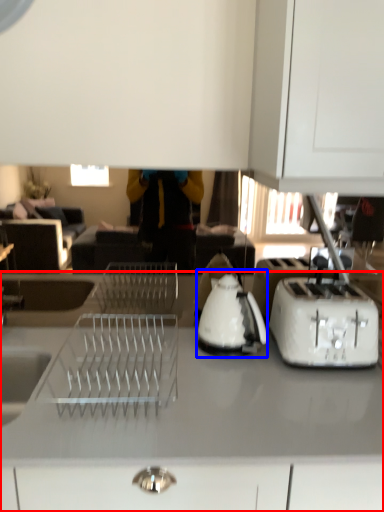
Question: Which of the following is the farthest to the observer, countertop (highlighted by a red box) or kettle (highlighted by a blue box)?

Choices:
 (A) countertop
 (B) kettle

Answer: (B)